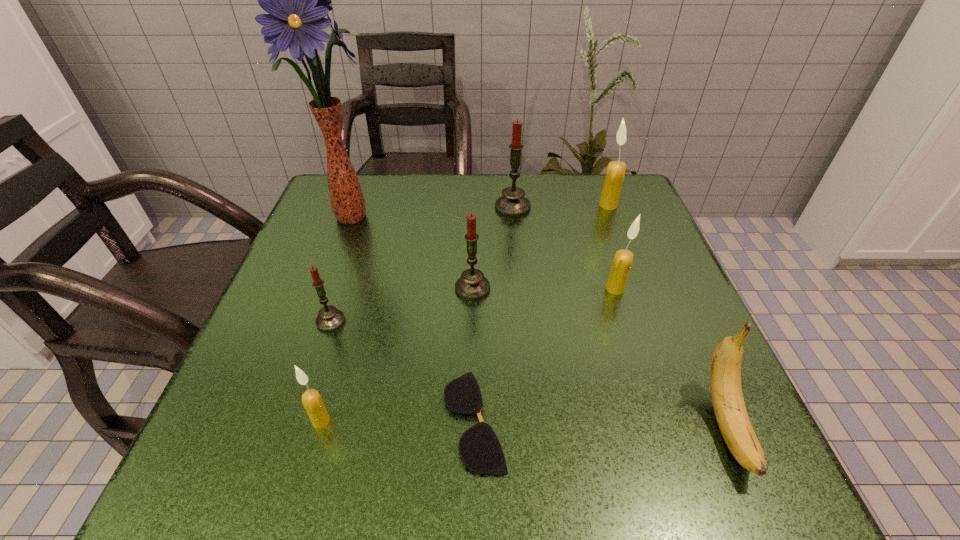
Locate an element on the screen. vacant space located 0.120m on the left of the second smallest red candle is located at coordinates (395, 288).

This screenshot has height=540, width=960. What are the coordinates of `free spot located on the front of the seventh object from left to right` in the screenshot? It's located at (634, 348).

This screenshot has height=540, width=960. I want to click on vacant space located 0.210m on the back of the nearest red candle, so click(357, 242).

Where is `free region located on the back of the nearest cream candle`? free region located on the back of the nearest cream candle is located at coordinates (351, 316).

Image resolution: width=960 pixels, height=540 pixels. I want to click on free space located 0.070m on the left of the spectacles, so click(x=396, y=420).

At what (x,y) coordinates should I click in order to perform the action: click on flower arrangement that is at the far edge. Please return your answer as a coordinate pair (x, y). Image resolution: width=960 pixels, height=540 pixels. Looking at the image, I should click on (297, 0).

Identify the location of banana at the near edge. (725, 370).

At what (x,y) coordinates should I click in order to perform the action: click on spectacles positioned at the near edge. Please return your answer as a coordinate pair (x, y). Looking at the image, I should click on (479, 447).

Locate an element on the screen. The height and width of the screenshot is (540, 960). flower arrangement present at the left edge is located at coordinates (297, 0).

At what (x,y) coordinates should I click in order to perform the action: click on banana that is at the right edge. Please return your answer as a coordinate pair (x, y). The height and width of the screenshot is (540, 960). Looking at the image, I should click on (725, 370).